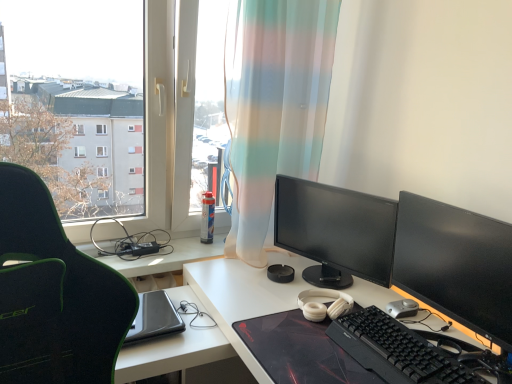
Identify the location of vacant space underneath translucent fabric curtain at center (from a real-world perspective). Image resolution: width=512 pixels, height=384 pixels. (224, 265).